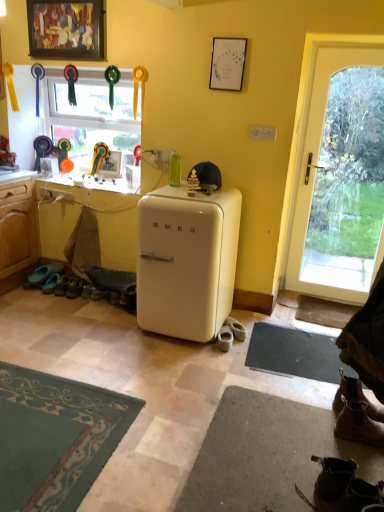
Locate an element on the screen. vacant space situated above black rubber yoga mat at lower right (from a real-world perspective) is located at coordinates (297, 353).